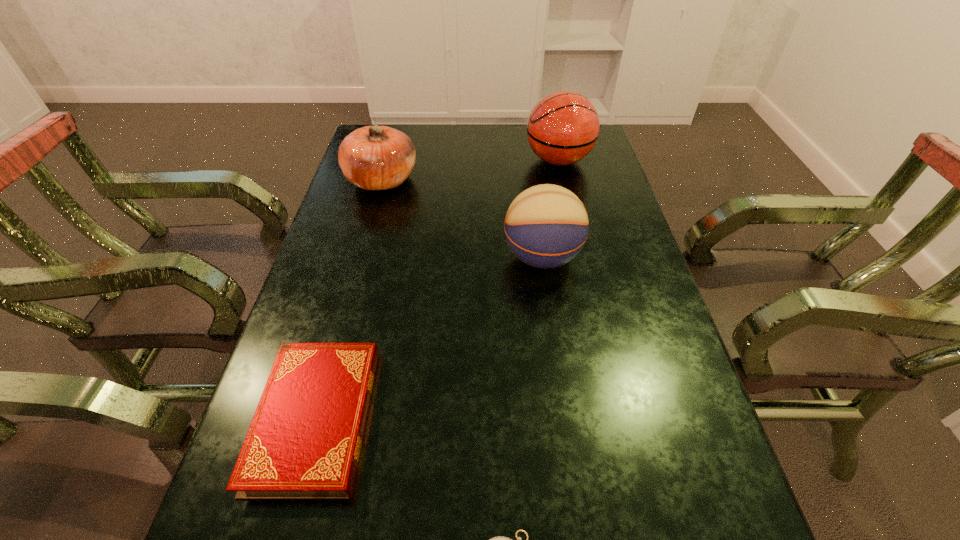
The image size is (960, 540). Identify the location of free location at the right edge. (613, 218).

Locate an element on the screen. free point between the farther basketball and the fourth tallest object is located at coordinates (438, 289).

In order to click on free space between the hardback book and the farther basketball in this screenshot , I will do `click(438, 289)`.

The height and width of the screenshot is (540, 960). Find the location of `vacant area between the pumpkin and the farther basketball`. vacant area between the pumpkin and the farther basketball is located at coordinates (470, 170).

At what (x,y) coordinates should I click in order to perform the action: click on vacant space that is in between the nearer basketball and the third tallest object. Please return your answer as a coordinate pair (x, y). Looking at the image, I should click on (462, 219).

The height and width of the screenshot is (540, 960). Find the location of `empty space that is in between the fourth tallest object and the pumpkin`. empty space that is in between the fourth tallest object and the pumpkin is located at coordinates tap(349, 299).

Find the location of a particular element. This screenshot has width=960, height=540. object identified as the second closest to the third nearest object is located at coordinates (375, 157).

Where is `object that can be found as the third closest to the second nearest object`? This screenshot has width=960, height=540. object that can be found as the third closest to the second nearest object is located at coordinates (375, 157).